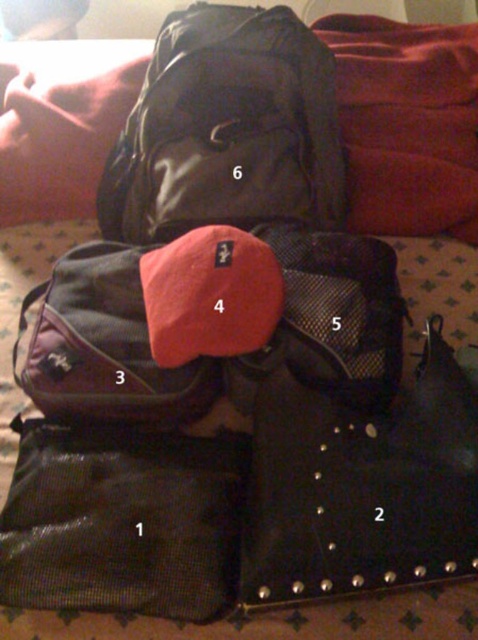
Who is taller, black studded bag at center or red soft pillow at upper left?

red soft pillow at upper left

Can you confirm if black studded bag at center is positioned to the left of red soft pillow at upper left?

Incorrect, black studded bag at center is not on the left side of red soft pillow at upper left.

Does point (370, 518) come closer to viewer compared to point (98, 51)?

Yes, it is.

This screenshot has height=640, width=478. In order to click on black studded bag at center in this screenshot , I will do `click(362, 484)`.

Can you confirm if matte black backpack at upper center is positioned to the right of red soft pillow at upper left?

Yes, matte black backpack at upper center is to the right of red soft pillow at upper left.

Can you confirm if matte black backpack at upper center is thinner than red soft pillow at upper left?

No.

Locate an element on the screen. matte black backpack at upper center is located at coordinates (228, 129).

What do you see at coordinates (228, 129) in the screenshot? This screenshot has width=478, height=640. I see `matte black backpack at upper center` at bounding box center [228, 129].

At what (x,y) coordinates should I click in order to perform the action: click on matte black backpack at upper center. Please return your answer as a coordinate pair (x, y). This screenshot has height=640, width=478. Looking at the image, I should click on [228, 129].